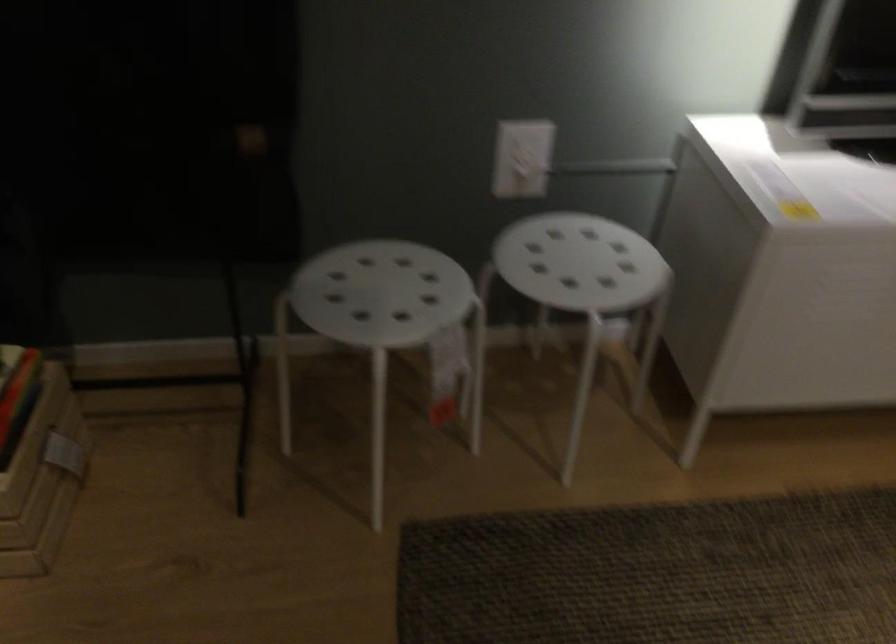
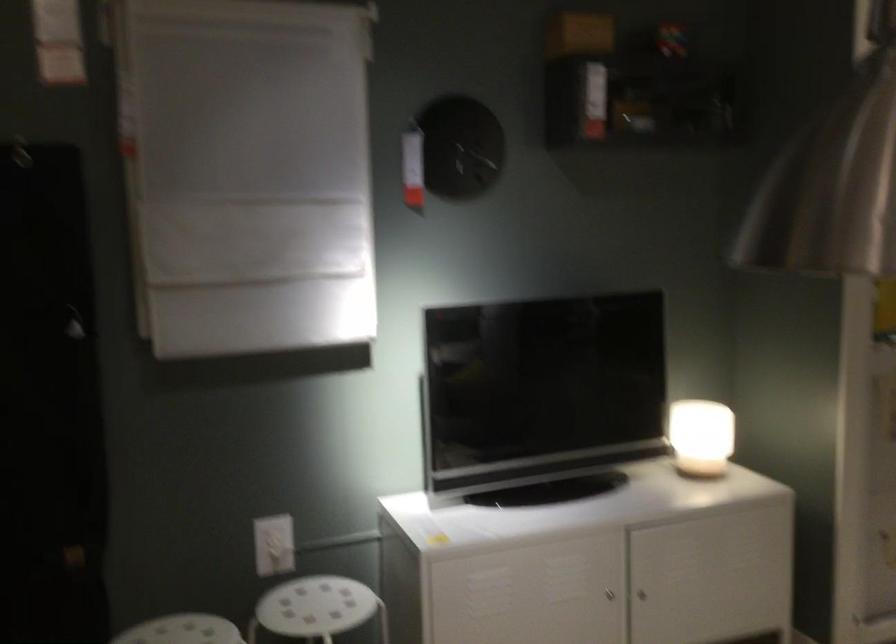
Where in the second image is the point corresponding to point (391, 260) from the first image?

(182, 630)